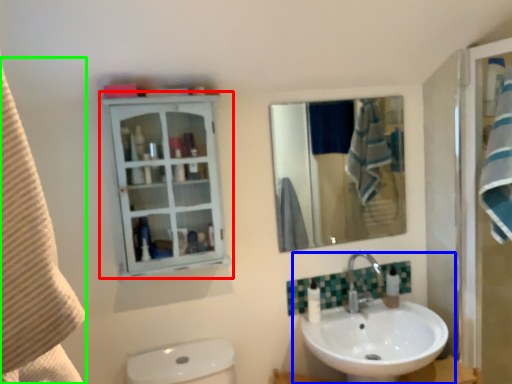
Question: Which object is positioned farthest from bathroom cabinet (highlighted by a red box)? Select from sink (highlighted by a blue box) and beach towel (highlighted by a green box).

Choices:
 (A) sink
 (B) beach towel

Answer: (B)